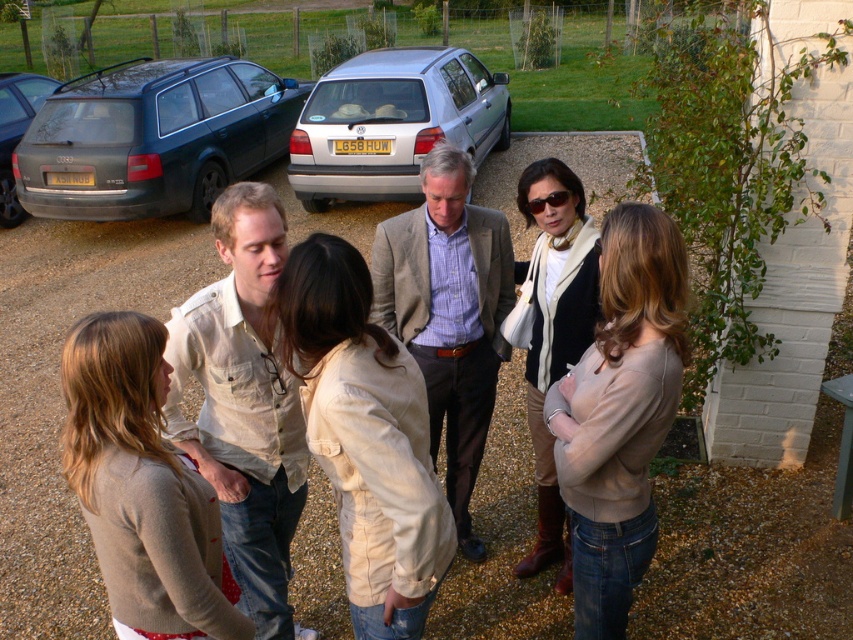
Based on the photo, you are standing in the driveway and want to hand a document to both the person wearing the beige cotton jacket at center and the person wearing the light beige sweater at lower left. Which person should you approach first to ensure you can reach them without moving past the other?

You should approach the beige cotton jacket at center first because it is closer to you than the light beige sweater at lower left, so you can reach them without needing to move past the other person.

You are organizing a clothing donation drive and need to determine which item takes up more space in the donation box. Given the beige cotton shirt at center and the matte beige sweater at center, which one has a greater width?

The beige cotton shirt at center has a greater width than the matte beige sweater at center.